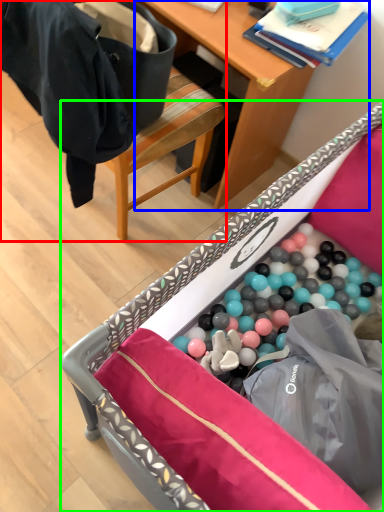
Question: Which object is positioned closest to chair (highlighted by a red box)? Select from desk (highlighted by a blue box) and furniture (highlighted by a green box).

Choices:
 (A) desk
 (B) furniture

Answer: (A)